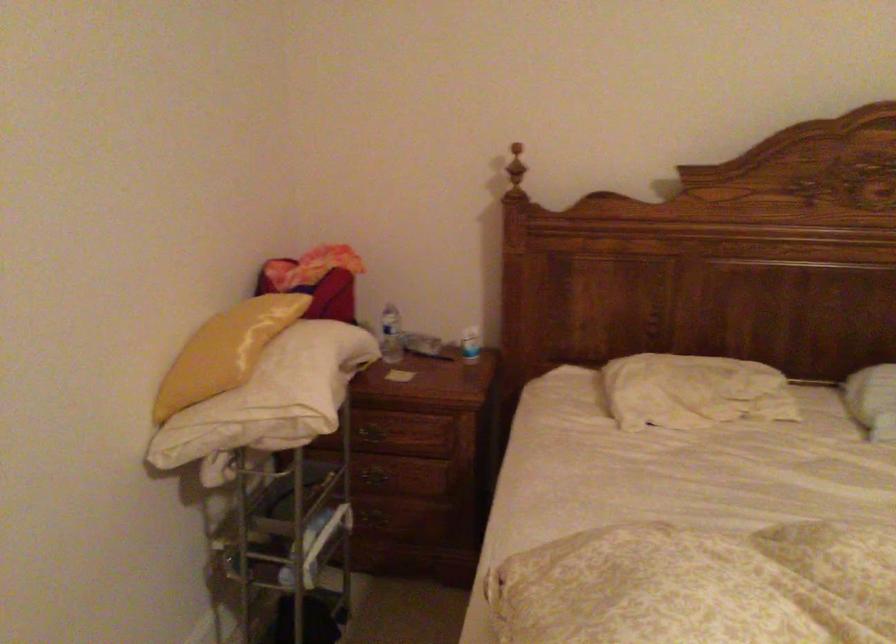
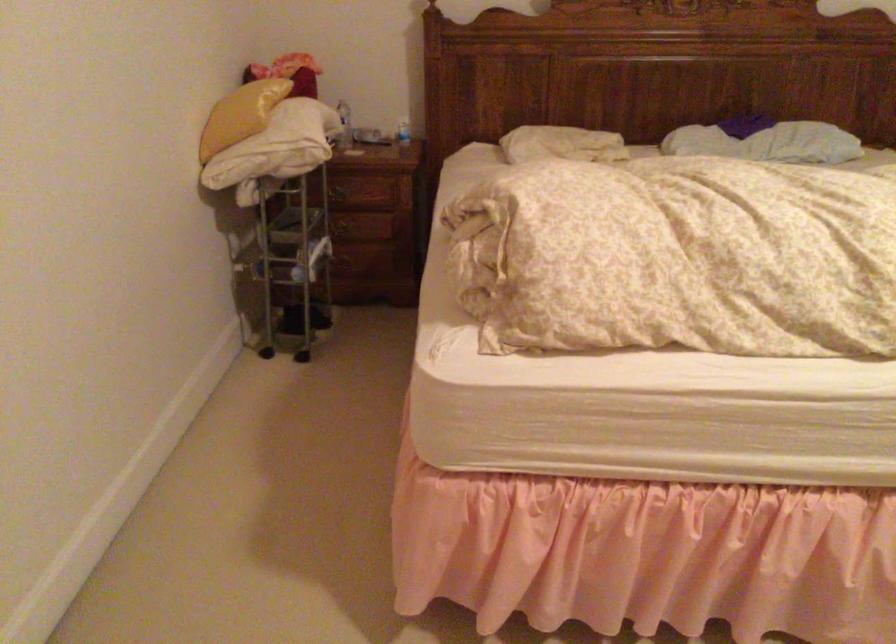
In the second image, find the point that corresponds to point 684,395 in the first image.

(561, 144)